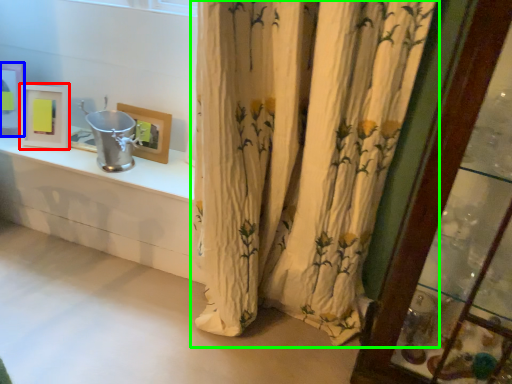
Question: Estimate the real-world distances between objects in this image. Which object is farther from picture frame (highlighted by a red box), picture frame (highlighted by a blue box) or curtain (highlighted by a green box)?

Choices:
 (A) picture frame
 (B) curtain

Answer: (B)